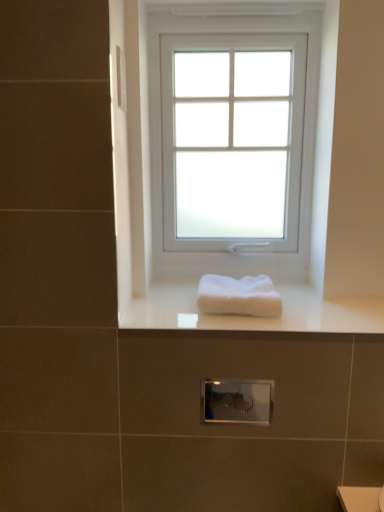
You are a GUI agent. You are given a task and a screenshot of the screen. Output one action in this format:
    pyautogui.click(x=<x>, y=<y>)
    Task: Click on the vacant area to the right of white fluffy towel at center
    
    Given the screenshot: What is the action you would take?
    pyautogui.click(x=318, y=314)